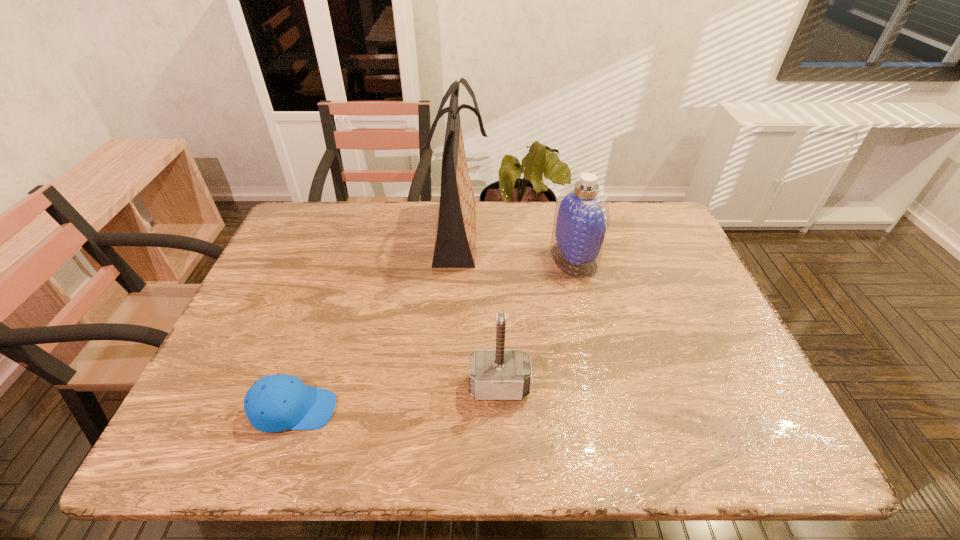
The height and width of the screenshot is (540, 960). I want to click on empty location between the shortest object and the second shortest object, so click(396, 398).

Identify the location of free space that is in between the shopping bag and the shortest object. The width and height of the screenshot is (960, 540). (376, 321).

Find the location of a particular element. The image size is (960, 540). free area in between the leftmost object and the rightmost object is located at coordinates (434, 334).

At what (x,y) coordinates should I click in order to perform the action: click on free spot between the rightmost object and the cap. Please return your answer as a coordinate pair (x, y). This screenshot has width=960, height=540. Looking at the image, I should click on (434, 334).

Identify the location of free spot between the cap and the shopping bag. This screenshot has height=540, width=960. (376, 321).

Find the location of a particular element. The width and height of the screenshot is (960, 540). vacant space that's between the tallest object and the rightmost object is located at coordinates (516, 246).

Where is `vacant space in between the tallest object and the shortest object`? The width and height of the screenshot is (960, 540). vacant space in between the tallest object and the shortest object is located at coordinates (376, 321).

You are a GUI agent. You are given a task and a screenshot of the screen. Output one action in this format:
    pyautogui.click(x=<x>, y=<y>)
    Task: Click on the vacant area between the hammer and the cleansing agent
    The image size is (960, 540).
    Given the screenshot: What is the action you would take?
    pyautogui.click(x=537, y=322)

Choose which object is the nearest neighbor to the hammer. Please provide its 2D coordinates. Your answer should be formatted as a tuple, i.e. [(x, y)], where the tuple contains the x and y coordinates of a point satisfying the conditions above.

[(274, 403)]

In order to click on object that is the second closest to the cap in this screenshot , I will do `click(454, 247)`.